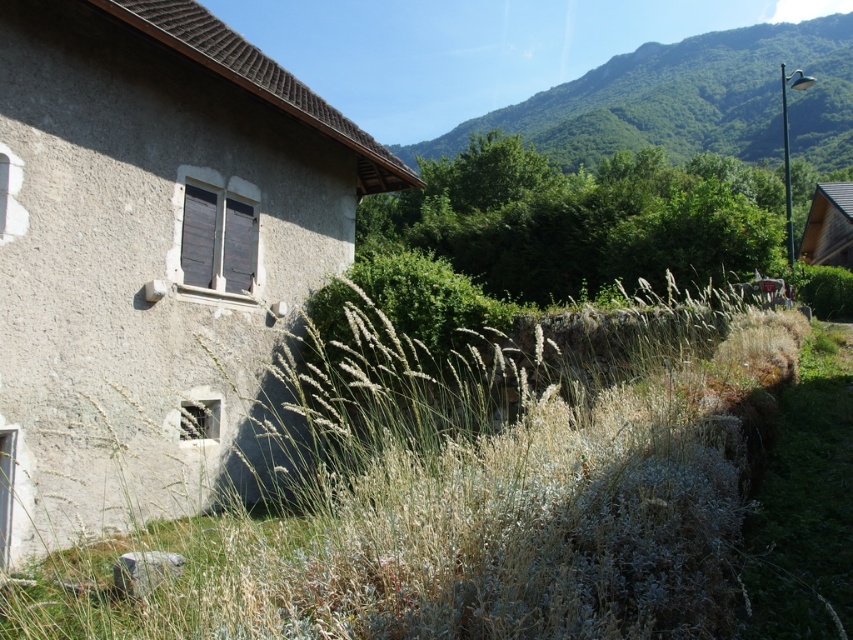
Can you confirm if green leafy hillside at upper center is positioned above wooden hut at right?

Indeed, green leafy hillside at upper center is positioned over wooden hut at right.

Between green leafy hillside at upper center and wooden hut at right, which one appears on the left side from the viewer's perspective?

wooden hut at right

Who is more forward, (621,77) or (816,188)?

Positioned in front is point (816,188).

What are the coordinates of `green leafy hillside at upper center` in the screenshot? It's located at (688, 100).

Can you confirm if green grass at center is bigger than gray stucco wall at left?

Indeed, green grass at center has a larger size compared to gray stucco wall at left.

Does point (604, 323) come behind point (103, 51)?

Yes, point (604, 323) is farther from viewer.

Identify the location of green grass at center. (471, 490).

Is gray stucco wall at left shorter than wooden hut at right?

Incorrect, gray stucco wall at left's height does not fall short of wooden hut at right's.

Is gray stucco wall at left to the left of wooden hut at right from the viewer's perspective?

Indeed, gray stucco wall at left is positioned on the left side of wooden hut at right.

This screenshot has width=853, height=640. Find the location of `gray stucco wall at left`. gray stucco wall at left is located at coordinates (149, 252).